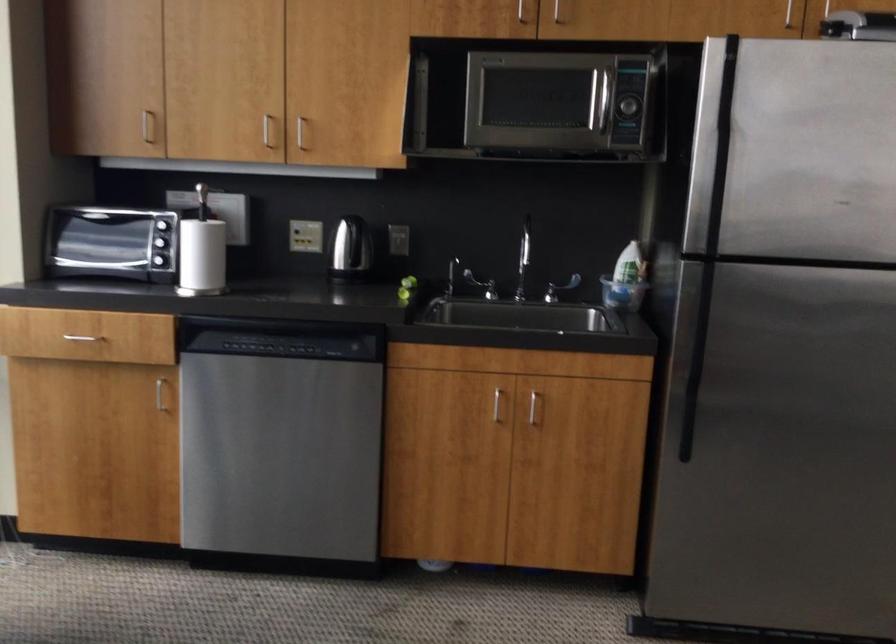
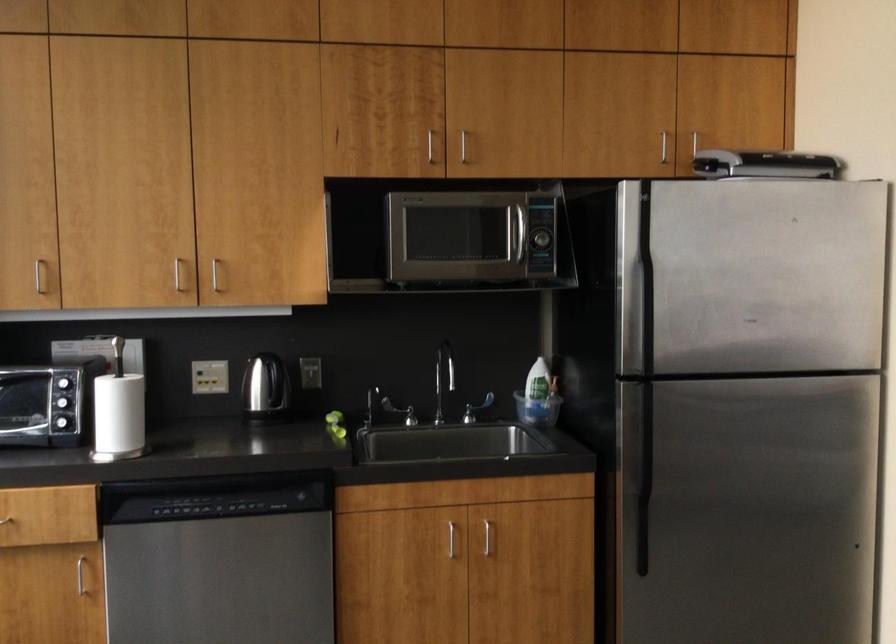
Find the pixel in the second image that matches the point at 496,404 in the first image.

(450, 538)